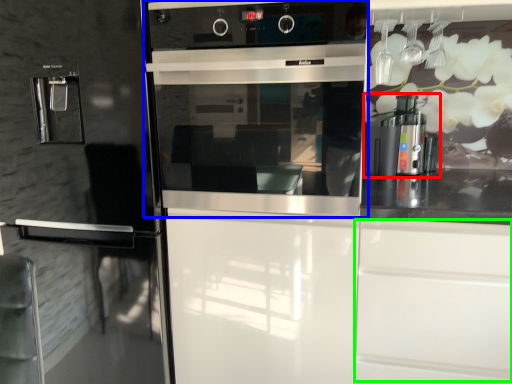
Question: Which object is the farthest from coffee machine (highlighted by a red box)? Choose among these: home appliance (highlighted by a blue box) or drawer (highlighted by a green box).

Choices:
 (A) home appliance
 (B) drawer

Answer: (A)